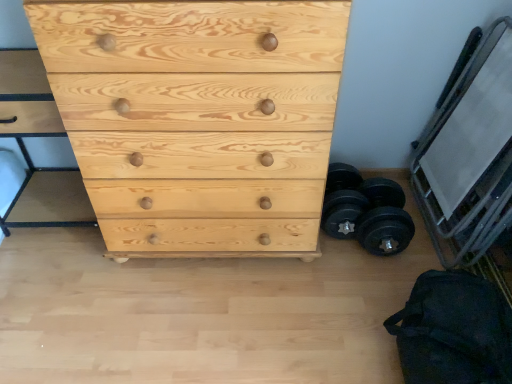
Question: Is metallic silver bunk bed at right with black rubber dumbbell at lower right?

Choices:
 (A) no
 (B) yes

Answer: (A)

Question: Is metallic silver bunk bed at right outside black rubber dumbbell at lower right?

Choices:
 (A) no
 (B) yes

Answer: (B)

Question: Considering the relative sizes of metallic silver bunk bed at right and black rubber dumbbell at lower right in the image provided, is metallic silver bunk bed at right wider than black rubber dumbbell at lower right?

Choices:
 (A) yes
 (B) no

Answer: (B)

Question: From the image's perspective, is metallic silver bunk bed at right located beneath black rubber dumbbell at lower right?

Choices:
 (A) no
 (B) yes

Answer: (A)

Question: From a real-world perspective, does metallic silver bunk bed at right stand above black rubber dumbbell at lower right?

Choices:
 (A) yes
 (B) no

Answer: (A)

Question: Is black rubber dumbbell at lower right wider or thinner than metallic silver bunk bed at right?

Choices:
 (A) thin
 (B) wide

Answer: (B)

Question: From a real-world perspective, is black rubber dumbbell at lower right above or below metallic silver bunk bed at right?

Choices:
 (A) below
 (B) above

Answer: (A)

Question: Is point (387, 228) closer or farther from the camera than point (453, 195)?

Choices:
 (A) farther
 (B) closer

Answer: (A)

Question: From their relative heights in the image, would you say black rubber dumbbell at lower right is taller or shorter than metallic silver bunk bed at right?

Choices:
 (A) tall
 (B) short

Answer: (B)

Question: In terms of width, does metallic silver bunk bed at right look wider or thinner when compared to black rubber dumbbell at lower right?

Choices:
 (A) thin
 (B) wide

Answer: (A)

Question: Does point (475, 67) appear closer or farther from the camera than point (362, 195)?

Choices:
 (A) farther
 (B) closer

Answer: (B)

Question: Based on their sizes in the image, would you say metallic silver bunk bed at right is bigger or smaller than black rubber dumbbell at lower right?

Choices:
 (A) big
 (B) small

Answer: (A)

Question: Considering the relative positions of metallic silver bunk bed at right and black rubber dumbbell at lower right in the image provided, is metallic silver bunk bed at right to the left or to the right of black rubber dumbbell at lower right?

Choices:
 (A) right
 (B) left

Answer: (A)

Question: In terms of width, does black fabric bag at lower right look wider or thinner when compared to natural wood chest of drawers at center?

Choices:
 (A) wide
 (B) thin

Answer: (B)

Question: Considering their positions, is black fabric bag at lower right located in front of or behind natural wood chest of drawers at center?

Choices:
 (A) behind
 (B) front

Answer: (A)